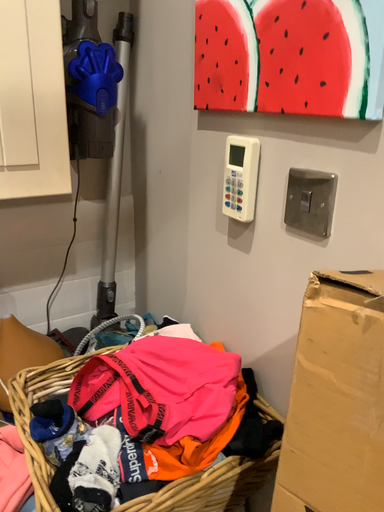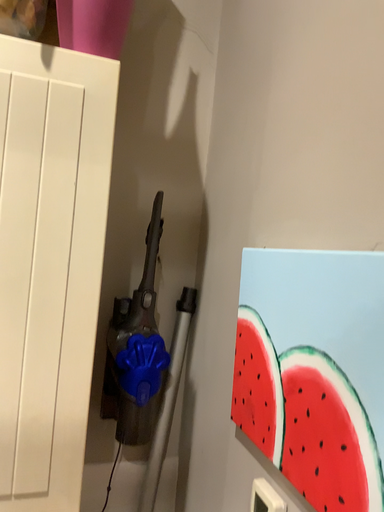
Question: Which way did the camera rotate in the video?

Choices:
 (A) rotated right
 (B) rotated left

Answer: (B)